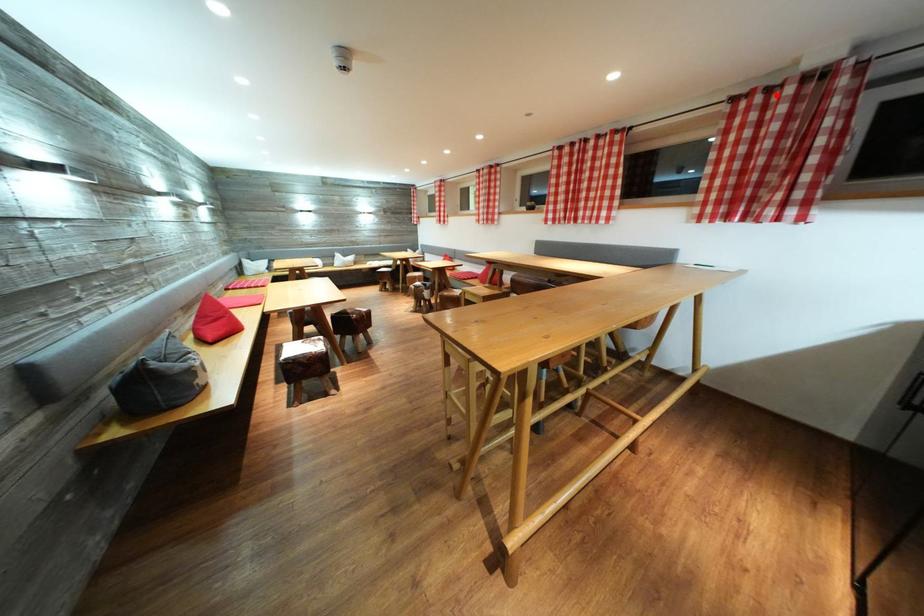
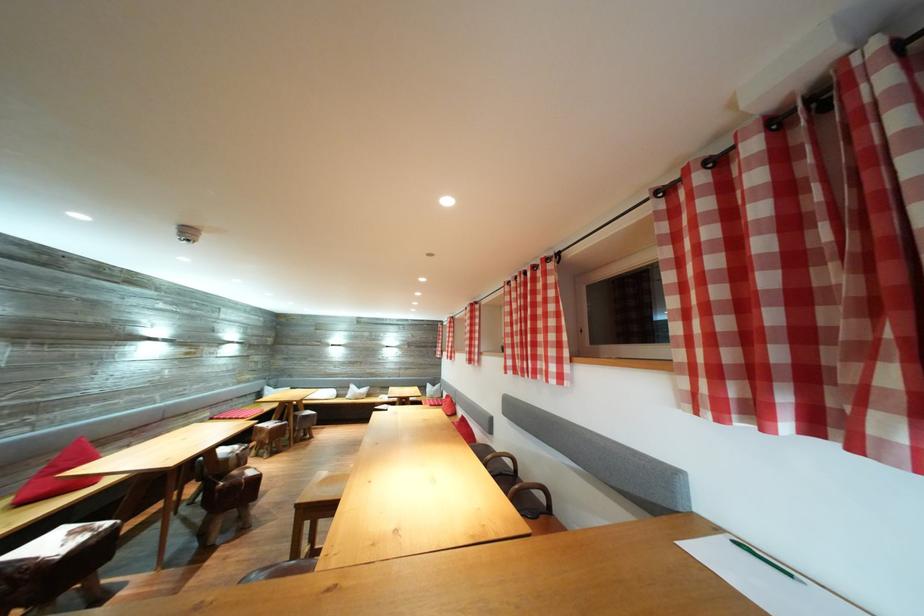
Locate, in the second image, the point that corresponds to the highlighted location in the first image.

(725, 166)